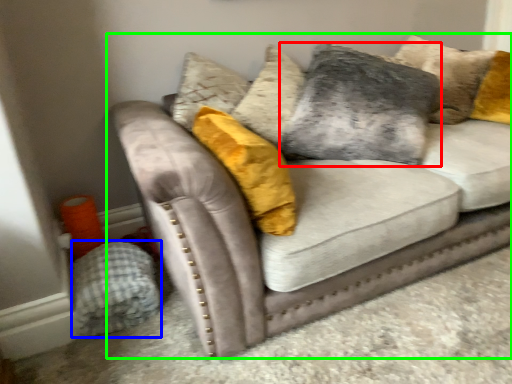
Question: Estimate the real-world distances between objects in this image. Which object is farther from pillow (highlighted by a red box), material (highlighted by a blue box) or studio couch (highlighted by a green box)?

Choices:
 (A) material
 (B) studio couch

Answer: (A)